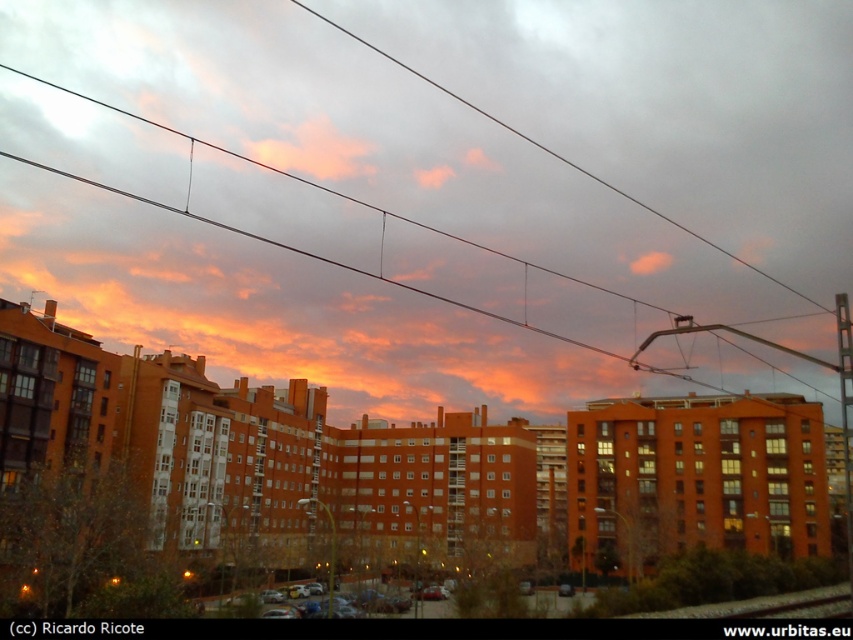
Question: From the image, what is the correct spatial relationship of orange sky at center in relation to black metal train track at lower right?

Choices:
 (A) above
 (B) below

Answer: (A)

Question: Among these objects, which one is farthest from the camera?

Choices:
 (A) orange sky at center
 (B) black metal train track at lower right

Answer: (A)

Question: Does orange sky at center have a lesser width compared to black metal train track at lower right?

Choices:
 (A) yes
 (B) no

Answer: (B)

Question: Which point appears closest to the camera in this image?

Choices:
 (A) (323, 42)
 (B) (824, 598)

Answer: (B)

Question: Is orange sky at center wider than black metal train track at lower right?

Choices:
 (A) no
 (B) yes

Answer: (B)